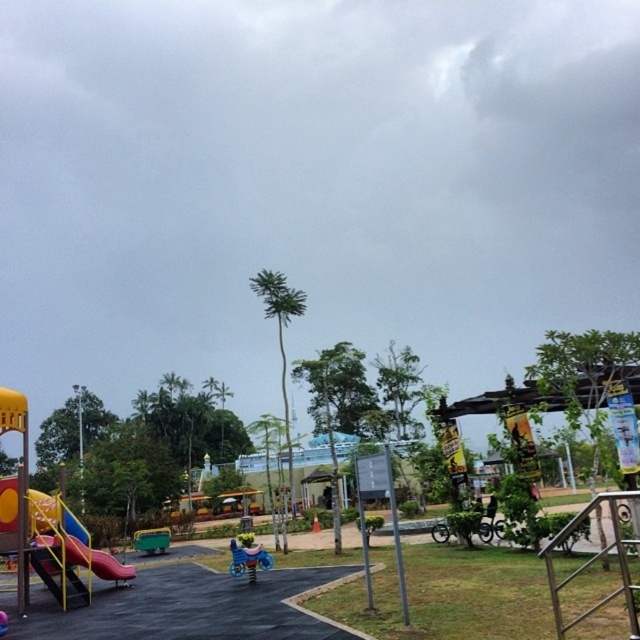
Question: Which is nearer to the metallic blue swing at center?

Choices:
 (A) multicolored plastic playground at lower left
 (B) yellow matte slide at lower left

Answer: (B)

Question: Can you confirm if yellow matte slide at lower left is positioned below metallic blue swing at center?

Choices:
 (A) yes
 (B) no

Answer: (B)

Question: Observing the image, what is the correct spatial positioning of yellow matte slide at lower left in reference to metallic blue swing at center?

Choices:
 (A) right
 (B) left

Answer: (B)

Question: Is multicolored plastic playground at lower left closer to the viewer compared to yellow matte slide at lower left?

Choices:
 (A) yes
 (B) no

Answer: (A)

Question: Which point appears closest to the camera in this image?

Choices:
 (A) (x=240, y=550)
 (B) (x=74, y=524)
 (C) (x=3, y=499)

Answer: (A)

Question: Which point is closer to the camera taking this photo?

Choices:
 (A) (240, 561)
 (B) (38, 493)

Answer: (A)